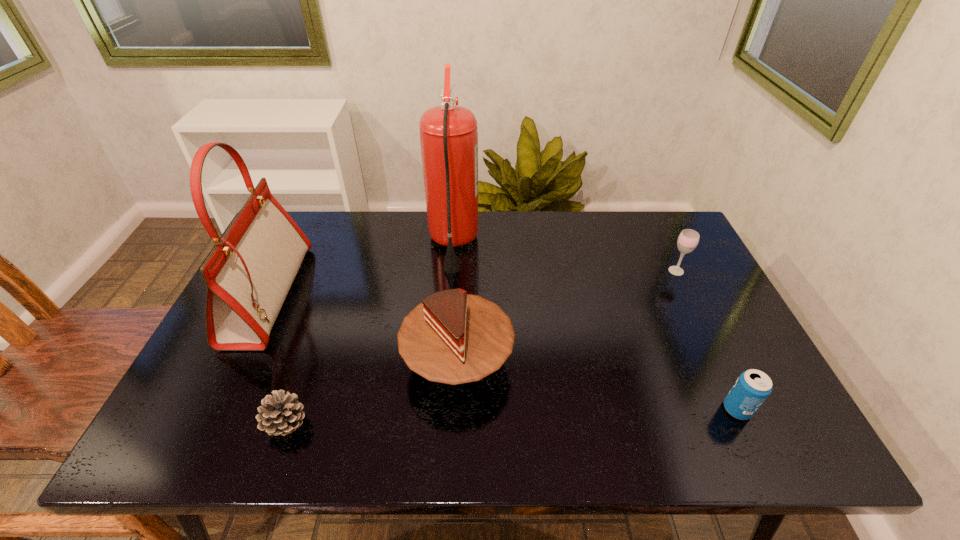
This screenshot has height=540, width=960. Find the location of `blank area in the image that satisfies the following two spatial constraints: 1. on the front side of the shortest object; 2. on the left side of the leftmost object`. blank area in the image that satisfies the following two spatial constraints: 1. on the front side of the shortest object; 2. on the left side of the leftmost object is located at coordinates (205, 424).

Locate an element on the screen. The image size is (960, 540). free space in the image that satisfies the following two spatial constraints: 1. on the back side of the shortest object; 2. on the right side of the fourth shortest object is located at coordinates (307, 361).